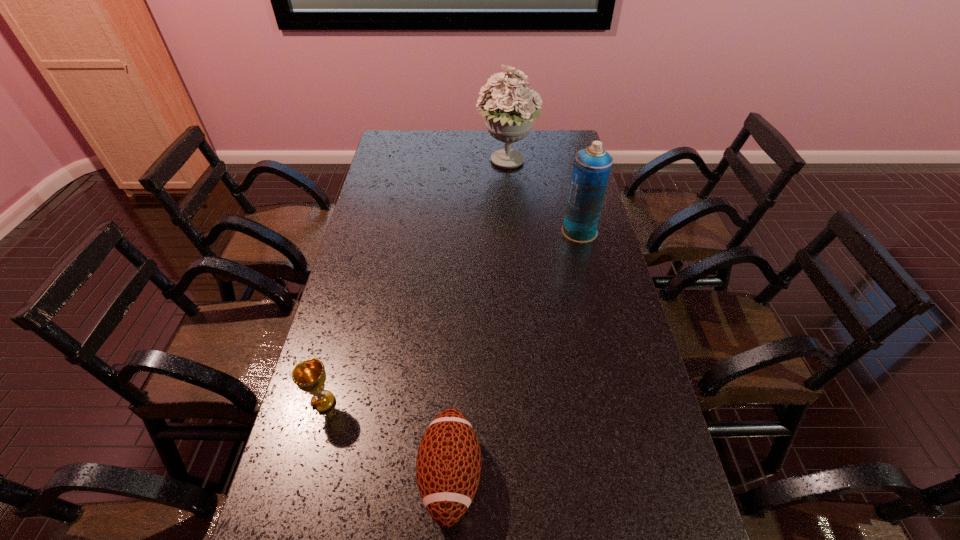
I want to click on vacant area between the rightmost object and the farthest object, so click(x=543, y=197).

At what (x,y) coordinates should I click in order to perform the action: click on vacant space that is in between the second farthest object and the football. Please return your answer as a coordinate pair (x, y). Looking at the image, I should click on (515, 353).

Identify the location of vacant space that's between the farthest object and the aerosol can. This screenshot has height=540, width=960. (543, 197).

At what (x,y) coordinates should I click in order to perform the action: click on free space between the second tallest object and the third farthest object. Please return your answer as a coordinate pair (x, y). Looking at the image, I should click on (451, 317).

Find the location of `vacant area between the chalice and the rightmost object`. vacant area between the chalice and the rightmost object is located at coordinates (451, 317).

Find the location of `free space between the nearest object and the second farthest object`. free space between the nearest object and the second farthest object is located at coordinates (515, 353).

The height and width of the screenshot is (540, 960). Identify the location of free space between the nearest object and the farthest object. (479, 319).

Identify the location of object that is the closest to the rightmost object. (509, 118).

I want to click on the second closest object to the bouquet, so click(x=309, y=376).

I want to click on vacant region that satisfies the following two spatial constraints: 1. on the back side of the bouquet; 2. on the left side of the nearest object, so click(x=465, y=163).